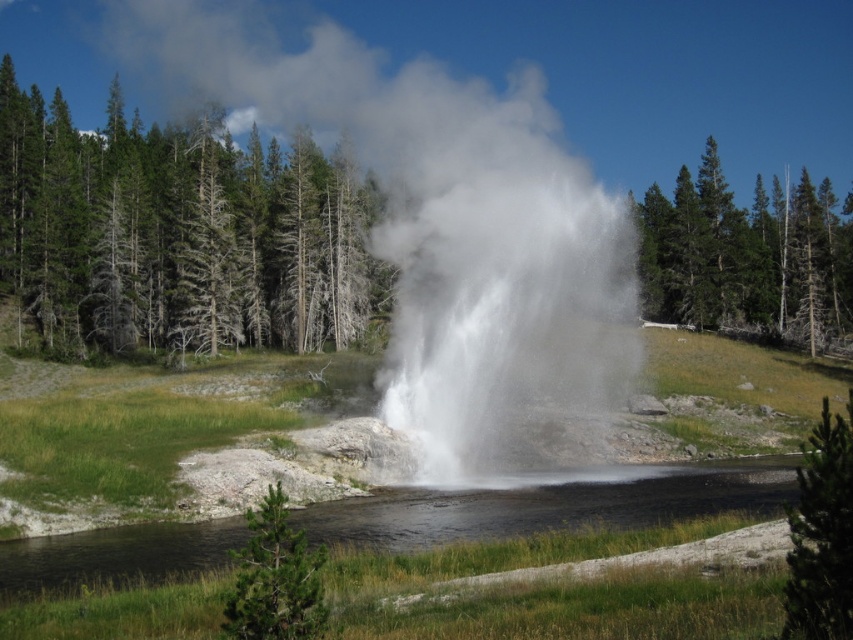
You are standing at the point marked as point (178, 234) in the scene. Based on the description, what type of vegetation are you surrounded by?

You are surrounded by green coniferous trees at left because the point (178, 234) is on green coniferous trees at left.